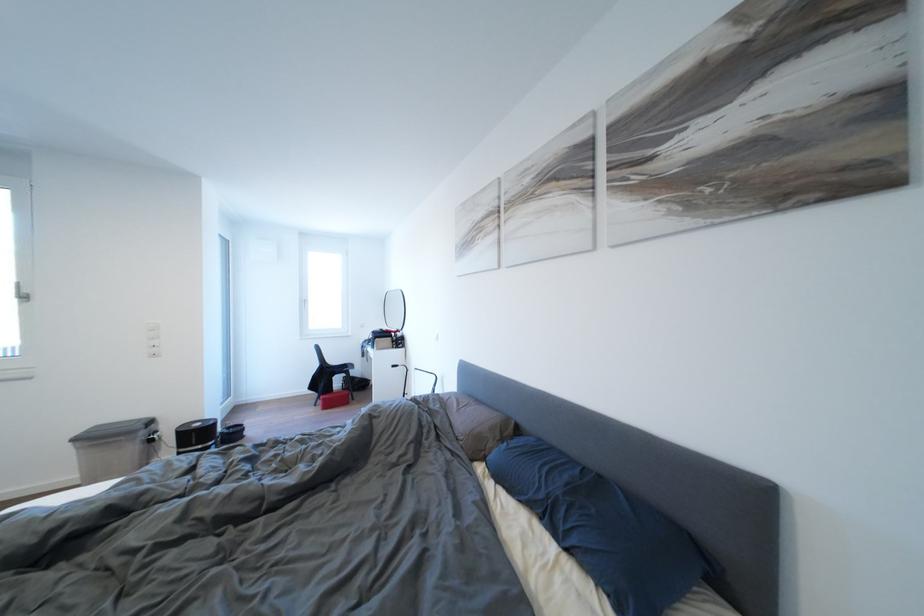
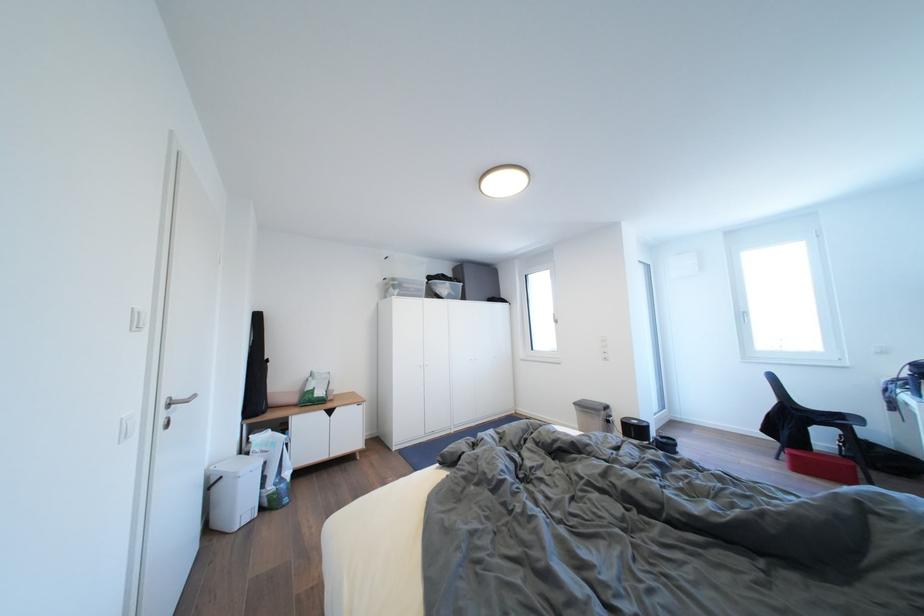
Question: The camera is either moving clockwise (left) or counter-clockwise (right) around the object. The first image is from the beginning of the video and the second image is from the end. Is the camera moving left or right when shooting the video?

Choices:
 (A) Left
 (B) Right

Answer: (B)